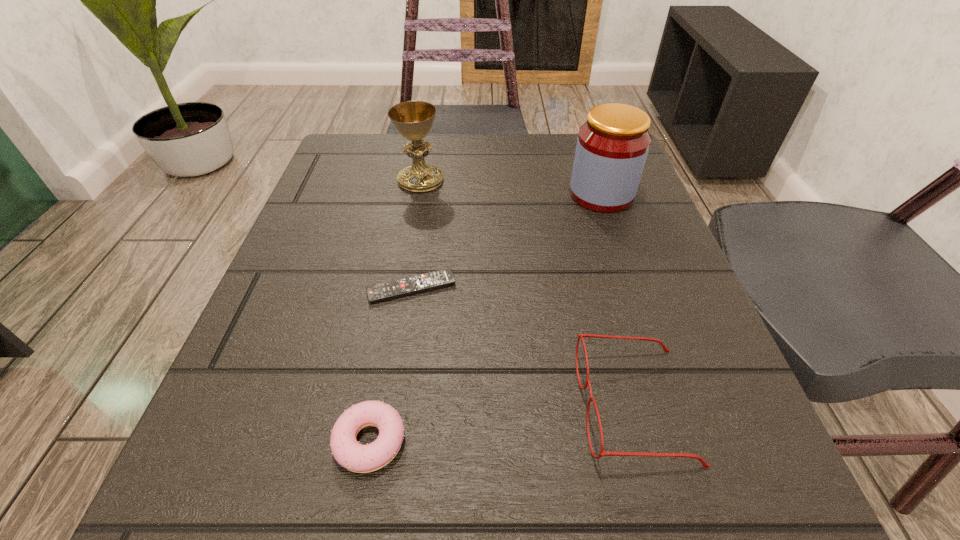
In order to click on free location located on the face of the spectacles in this screenshot , I will do `click(436, 406)`.

Find the location of a particular element. This screenshot has height=540, width=960. free spot located on the left of the doughnut is located at coordinates (283, 441).

The height and width of the screenshot is (540, 960). Identify the location of free space located on the back of the shortest object. (423, 212).

The image size is (960, 540). Find the location of `jar present at the far edge`. jar present at the far edge is located at coordinates (612, 146).

At what (x,y) coordinates should I click in order to perform the action: click on chalice that is at the far edge. Please return your answer as a coordinate pair (x, y). This screenshot has width=960, height=540. Looking at the image, I should click on (413, 120).

This screenshot has height=540, width=960. I want to click on spectacles situated at the near edge, so click(x=705, y=465).

Locate an element on the screen. The width and height of the screenshot is (960, 540). doughnut that is at the near edge is located at coordinates (x=346, y=450).

Identify the location of chalice present at the left edge. This screenshot has height=540, width=960. point(413,120).

Where is `doughnut that is at the left edge`? doughnut that is at the left edge is located at coordinates (346, 450).

This screenshot has height=540, width=960. In order to click on remote control that is at the left edge in this screenshot , I will do `click(411, 285)`.